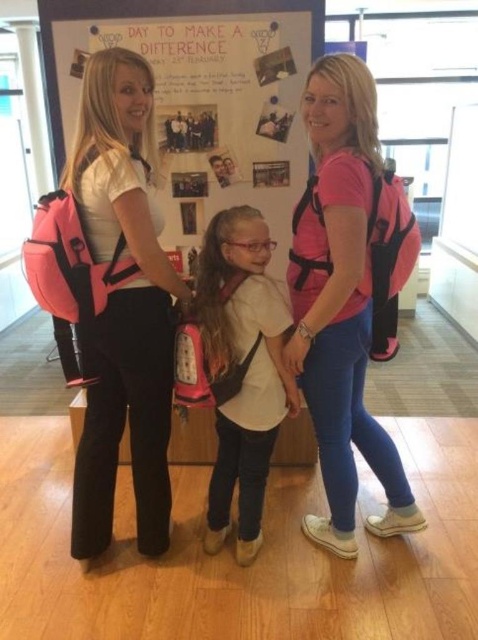
You are a photographer trying to capture a photo of the scene. You want to ensure that both the pink matte backpack at center and the matte pink backpack at left are clearly visible. Based on their positions, which backpack is positioned lower in the image?

The pink matte backpack at center is located below the matte pink backpack at left, so the pink matte backpack at center is positioned lower in the image.

Where is the pink matte backpack at center located in the image?

The pink matte backpack at center is located at point coordinates of 0.463 on the x axis and 0.728 on the y axis.

You are a student who needs to choose between the matte pink backpack at left and the pink fabric backpack at center for carrying your books. Which backpack can hold more books based on their sizes?

The matte pink backpack at left has a larger size compared to the pink fabric backpack at center, so it can hold more books.